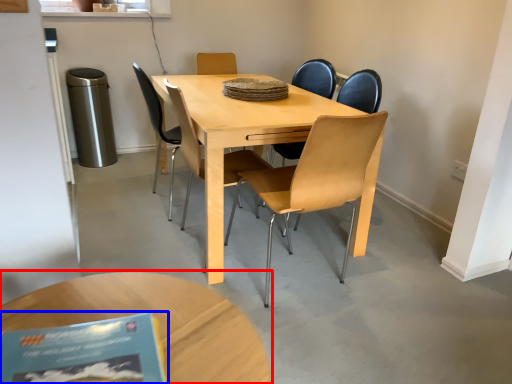
Question: Among these objects, which one is farthest to the camera, coffee table (highlighted by a red box) or book (highlighted by a blue box)?

Choices:
 (A) coffee table
 (B) book

Answer: (A)